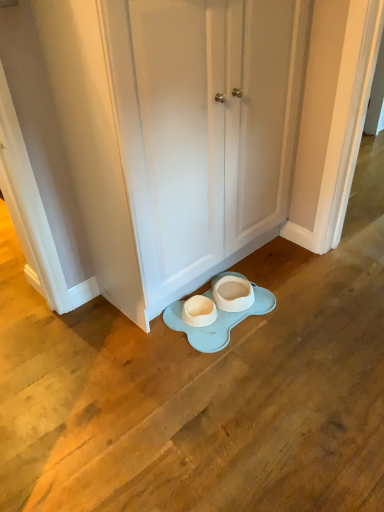
Identify the location of free space in front of white matte door at center. (237, 386).